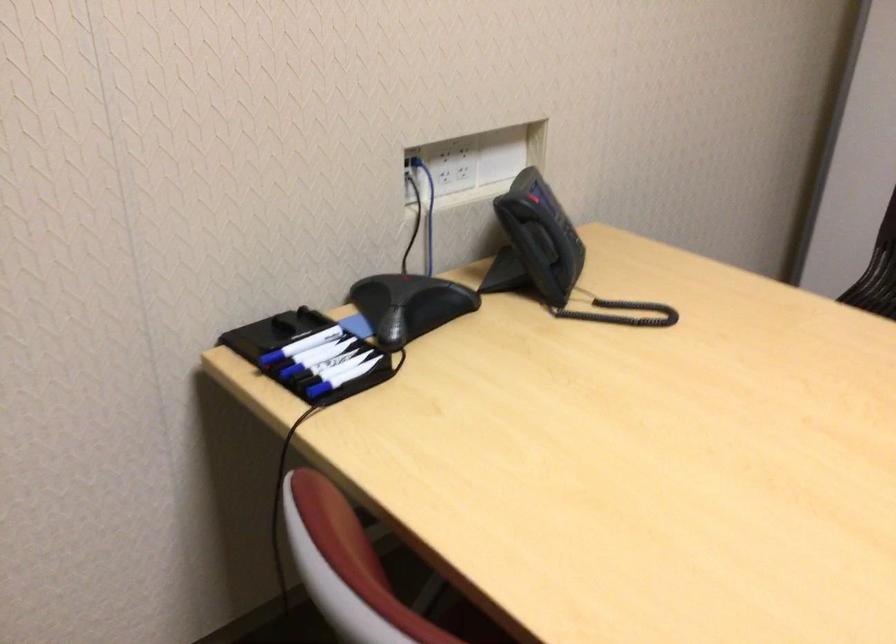
The width and height of the screenshot is (896, 644). What are the coordinates of `telephone button` in the screenshot? It's located at (562, 225).